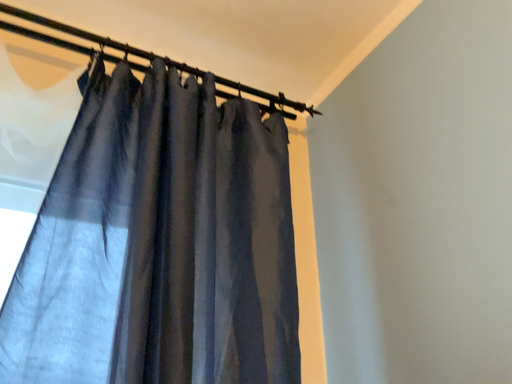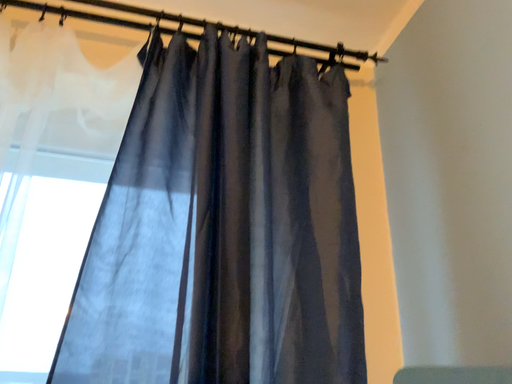
Question: How did the camera likely rotate when shooting the video?

Choices:
 (A) rotated left
 (B) rotated right

Answer: (A)